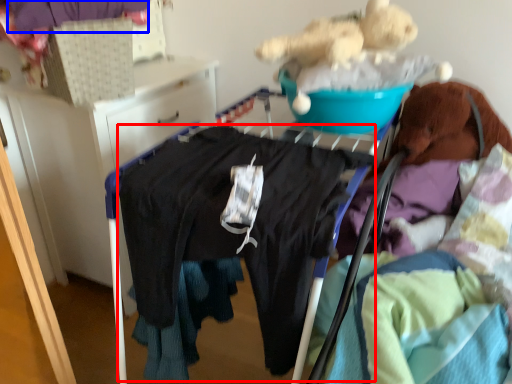
Question: Among these objects, which one is nearest to the camera, clothing (highlighted by a red box) or clothing (highlighted by a blue box)?

Choices:
 (A) clothing
 (B) clothing

Answer: (A)